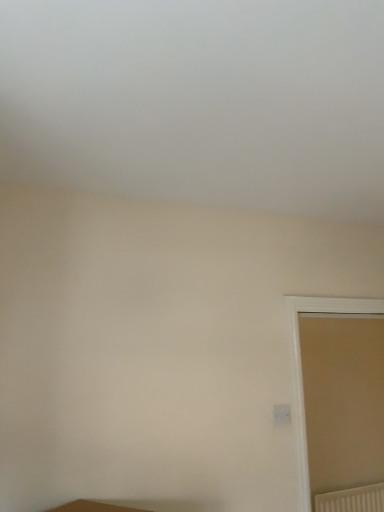
Question: From a real-world perspective, relative to white textured radiator at lower right, is beige matte door at right vertically above or below?

Choices:
 (A) below
 (B) above

Answer: (B)

Question: Looking at the image, does beige matte door at right seem bigger or smaller compared to white textured radiator at lower right?

Choices:
 (A) big
 (B) small

Answer: (A)

Question: From the image's perspective, is beige matte door at right above or below white textured radiator at lower right?

Choices:
 (A) below
 (B) above

Answer: (B)

Question: Looking at their shapes, would you say white textured radiator at lower right is wider or thinner than beige matte door at right?

Choices:
 (A) wide
 (B) thin

Answer: (B)

Question: Looking at the image, does white textured radiator at lower right seem bigger or smaller compared to beige matte door at right?

Choices:
 (A) small
 (B) big

Answer: (A)

Question: From the image's perspective, is white textured radiator at lower right located above or below beige matte door at right?

Choices:
 (A) below
 (B) above

Answer: (A)

Question: Is point (349, 492) closer or farther from the camera than point (296, 314)?

Choices:
 (A) closer
 (B) farther

Answer: (B)